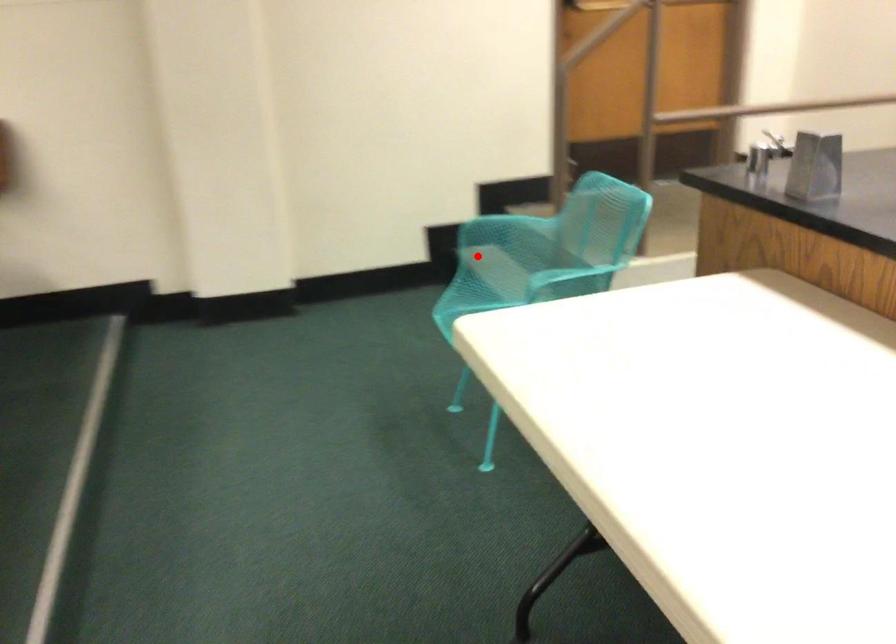
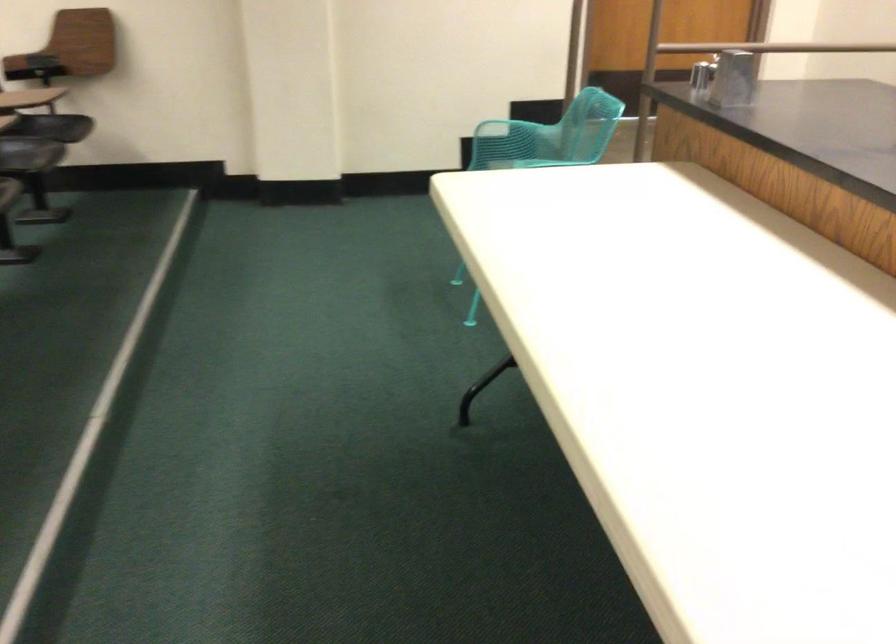
Question: I am providing you with two images of the same scene from different viewpoints. Image1 has a red point marked. In image2, the corresponding 3D location appears at what relative position? Reply with the corresponding letter.

Choices:
 (A) Closer
 (B) Farther

Answer: (B)